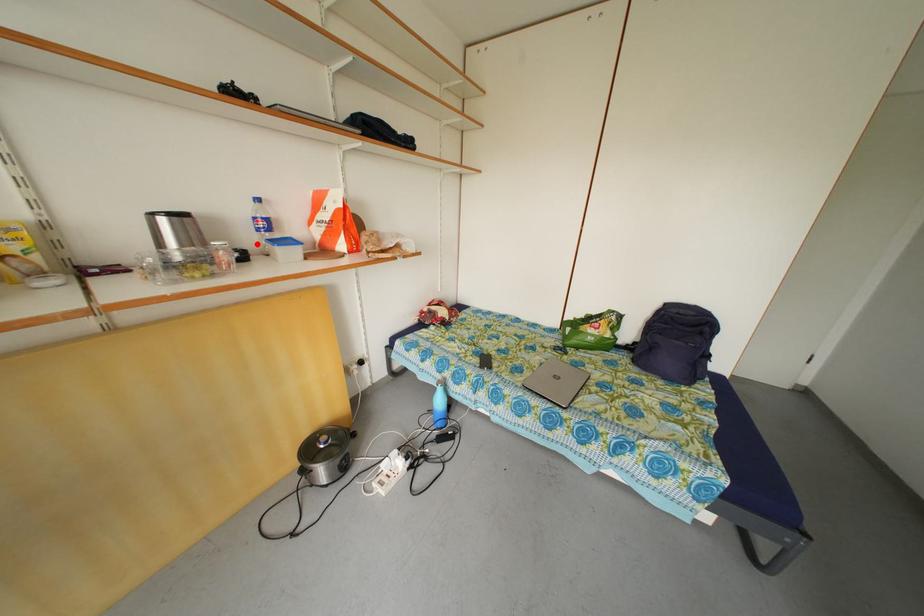
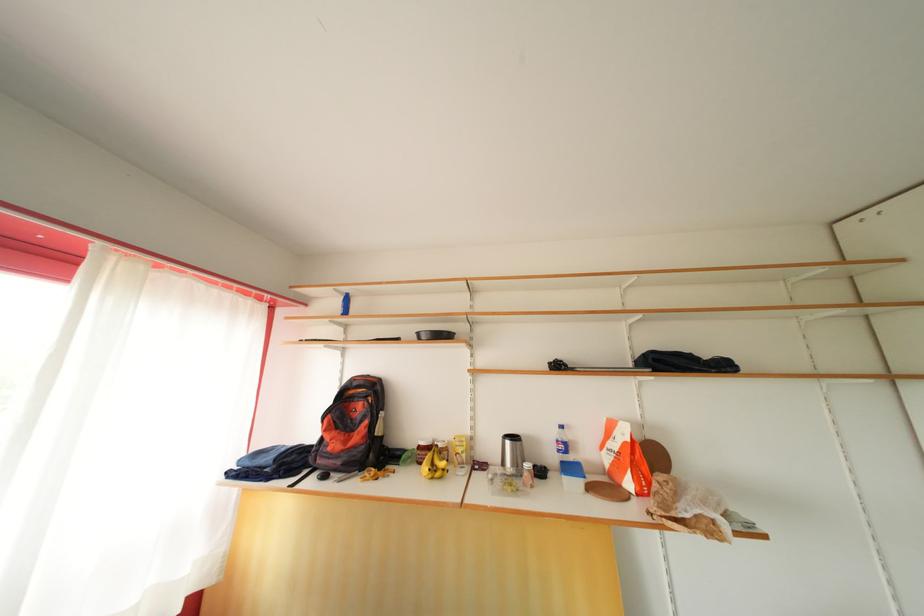
The point at the highlighted location is marked in the first image. Where is the corresponding point in the second image?

(558, 463)